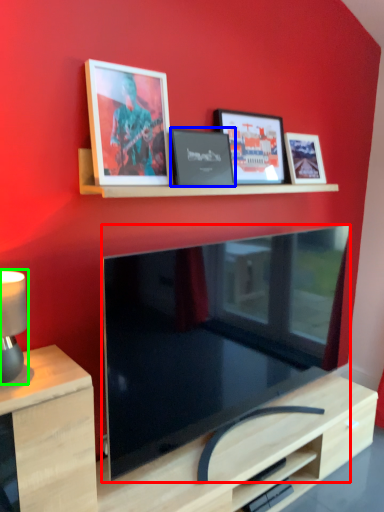
Question: Which is farther away from television (highlighted by a red box)? picture frame (highlighted by a blue box) or table lamp (highlighted by a green box)?

Choices:
 (A) picture frame
 (B) table lamp

Answer: (B)